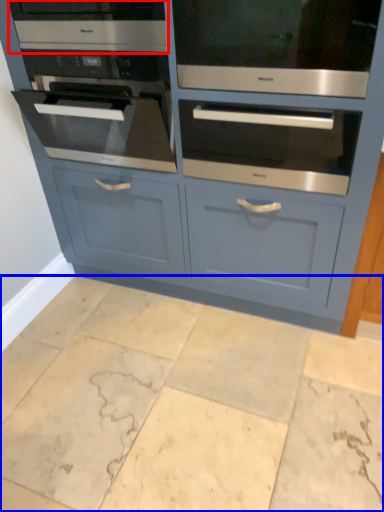
Question: Which object is further to the camera taking this photo, appliance (highlighted by a red box) or ceramic tile (highlighted by a blue box)?

Choices:
 (A) appliance
 (B) ceramic tile

Answer: (A)